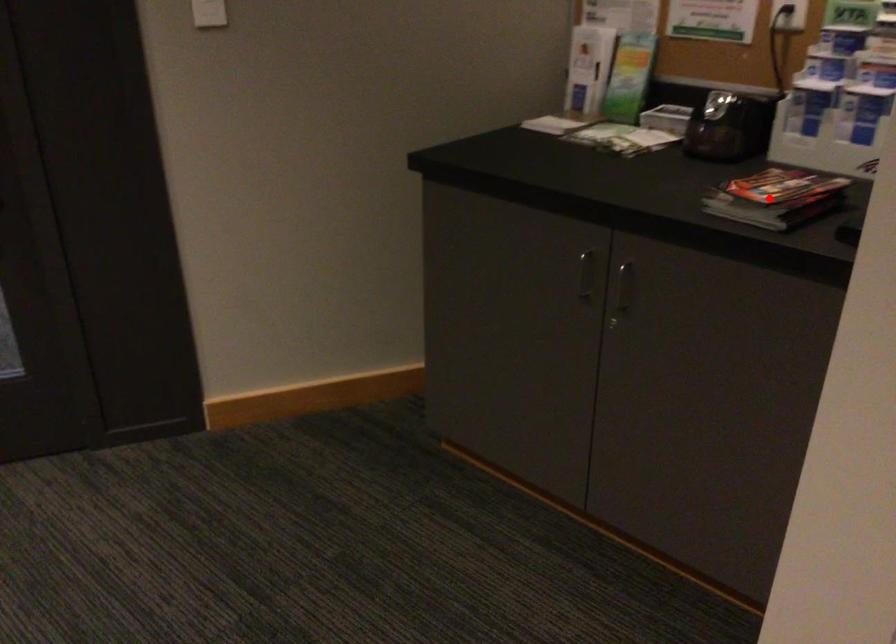
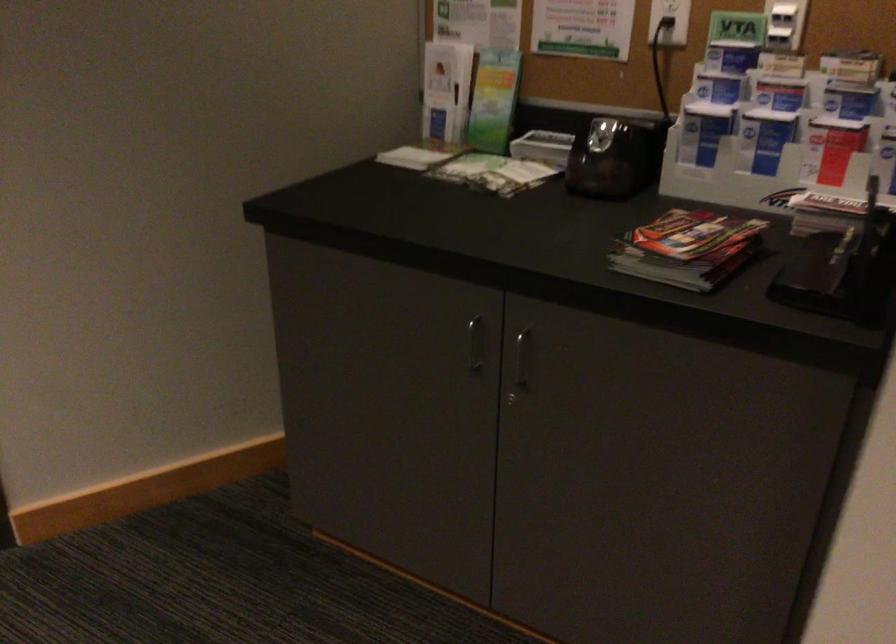
Question: A red point is marked in image1. In image2, is the corresponding 3D point closer to the camera or farther? Reply with the corresponding letter.

Choices:
 (A) The corresponding 3D point is closer.
 (B) The corresponding 3D point is farther.

Answer: (A)